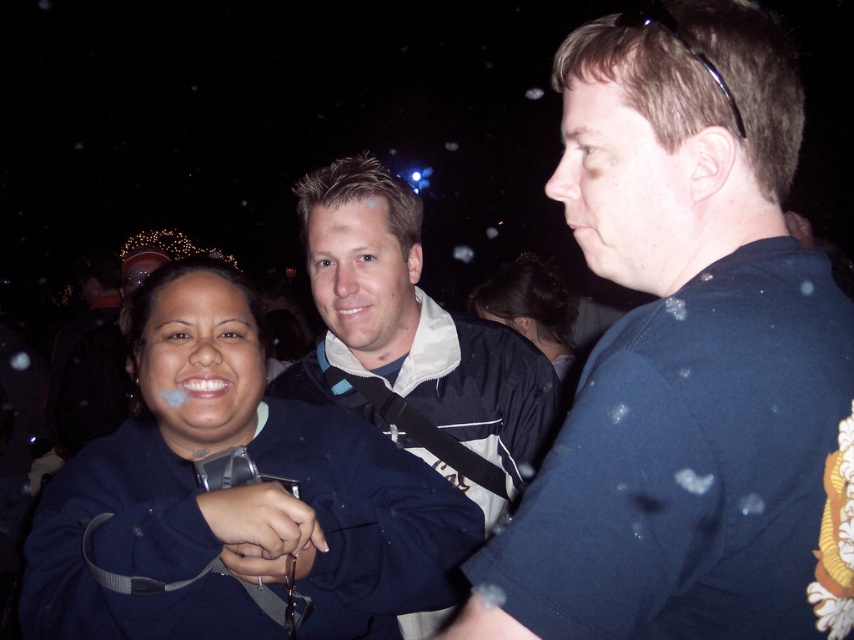
Question: Where is dark blue fabric shirt at center located in relation to dark brown hair at center in the image?

Choices:
 (A) below
 (B) above

Answer: (A)

Question: Which of the following is the closest to the observer?

Choices:
 (A) (564, 154)
 (B) (510, 360)
 (C) (551, 344)
 (D) (27, 545)

Answer: (A)

Question: Estimate the real-world distances between objects in this image. Which object is closer to the dark blue fabric shirt at center?

Choices:
 (A) dark blue jacket at center
 (B) dark blue shirt at center

Answer: (A)

Question: Does dark blue fabric shirt at center appear on the left side of dark blue jacket at center?

Choices:
 (A) no
 (B) yes

Answer: (B)

Question: Is dark blue jacket at center to the left of dark brown hair at center from the viewer's perspective?

Choices:
 (A) no
 (B) yes

Answer: (B)

Question: Estimate the real-world distances between objects in this image. Which object is farther from the dark blue shirt at center?

Choices:
 (A) dark brown hair at center
 (B) dark blue fabric shirt at center
 (C) dark blue jacket at center

Answer: (A)